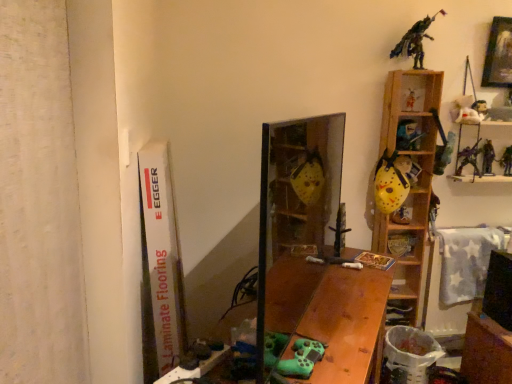
Question: Looking at their shapes, would you say wooden table at lower right, the first table positioned from the right, is wider or thinner than wooden picture frame at upper right?

Choices:
 (A) wide
 (B) thin

Answer: (A)

Question: Is wooden table at lower right, the first table positioned from the right, to the left or to the right of wooden picture frame at upper right in the image?

Choices:
 (A) left
 (B) right

Answer: (A)

Question: Considering the real-world distances, which object is farthest from the metallic silver figure at upper right, the fifth toy when ordered from left to right?

Choices:
 (A) black plastic sword at center, the 11th toy in the right-to-left sequence
 (B) plush white bear at upper right, which is the 10th toy in left-to-right order
 (C) wooden picture frame at upper right
 (D) yellow matte hockey mask at right, placed as the 10th toy when sorted from right to left
 (E) metallic silver figure at upper right, which ranks as the 2th toy in right-to-left order

Answer: (A)

Question: Which object is the closest to the plush white bear at upper right, which is the 10th toy in left-to-right order?

Choices:
 (A) metallic blue toy at upper right, marked as the 6th toy in a right-to-left arrangement
 (B) metallic silver figure at upper right, which ranks as the 2th toy in right-to-left order
 (C) white plush bear at upper right, which ranks as the eighth toy in left-to-right order
 (D) yellow matte hockey mask at right, which is the third toy from left to right
 (E) yellow matte hockey mask at upper right, the sixth toy viewed from the left

Answer: (C)